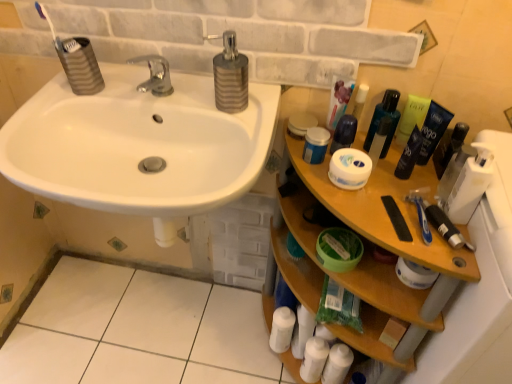
Where is `vacant space in front of blue plastic toothbrush at right, positioned as the first toothbrush in front-to-back order`? The height and width of the screenshot is (384, 512). vacant space in front of blue plastic toothbrush at right, positioned as the first toothbrush in front-to-back order is located at coordinates (438, 255).